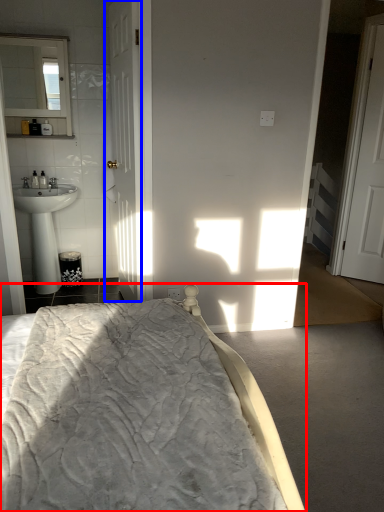
Question: Which of the following is the farthest to the observer, bed (highlighted by a red box) or door (highlighted by a blue box)?

Choices:
 (A) bed
 (B) door

Answer: (B)